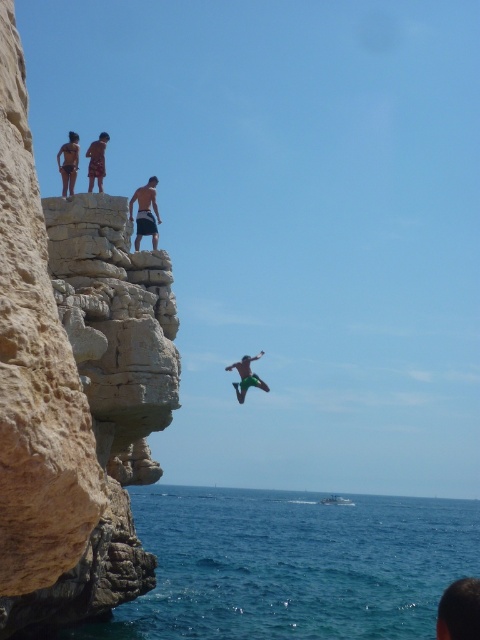
Question: Which point appears farthest from the camera in this image?

Choices:
 (A) (71, 188)
 (B) (137, 218)

Answer: (B)

Question: Which of the following is the closest to the observer?

Choices:
 (A) (168, 360)
 (B) (67, 152)
 (C) (139, 237)

Answer: (A)

Question: Does blue liquid water at lower center come in front of green fabric shorts at center?

Choices:
 (A) yes
 (B) no

Answer: (A)

Question: Which point is farther from the camera taking this photo?

Choices:
 (A) (423, 579)
 (B) (58, 154)
 (C) (153, 216)

Answer: (A)

Question: Does blue liquid water at lower center appear over dark brown shorts at upper center?

Choices:
 (A) yes
 (B) no

Answer: (B)

Question: From the image, what is the correct spatial relationship of dark blue shorts at upper center in relation to green fabric shorts at center?

Choices:
 (A) above
 (B) below

Answer: (A)